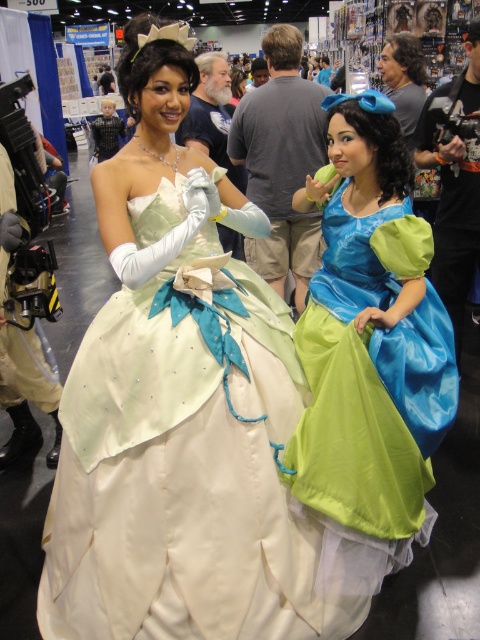
You are a photographer at a convention. You need to position a spotlight exactly at the center of the satin white dress at center. Given that the coordinate system starts from the bottom left corner of the image, can you confirm if the point you have chosen at coordinates point (193, 474) is indeed the center of the satin white dress at center?

Yes, the point (193, 474) is indeed the center of the satin white dress at center as specified in the description.

Looking at this image, you are a photographer at a convention and need to position two people for a photo. The first person is wearing a satin white dress at center. The second person is standing 1.71 meters away. What is the minimum distance you should set between them to ensure both can be in frame without overlapping?

The minimum distance between the two people should be at least 1.71 meters to ensure they do not overlap in the photo.